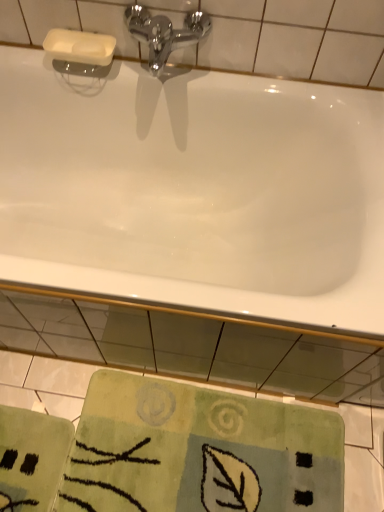
Question: From the image's perspective, is green textured rug at lower center located above or below white glossy bathtub at upper center?

Choices:
 (A) above
 (B) below

Answer: (B)

Question: From a real-world perspective, is green textured rug at lower center positioned above or below white glossy bathtub at upper center?

Choices:
 (A) above
 (B) below

Answer: (B)

Question: Estimate the real-world distances between objects in this image. Which object is closer to the green textured rug at lower center?

Choices:
 (A) white glossy bathtub at upper center
 (B) chrome metallic faucet at upper center

Answer: (A)

Question: Estimate the real-world distances between objects in this image. Which object is farther from the white glossy bathtub at upper center?

Choices:
 (A) green textured rug at lower center
 (B) chrome metallic faucet at upper center

Answer: (A)